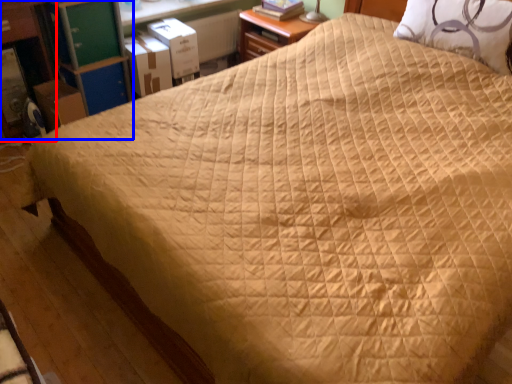
Question: Which object appears farthest to the camera in this image, dresser (highlighted by a red box) or dresser (highlighted by a blue box)?

Choices:
 (A) dresser
 (B) dresser

Answer: (B)